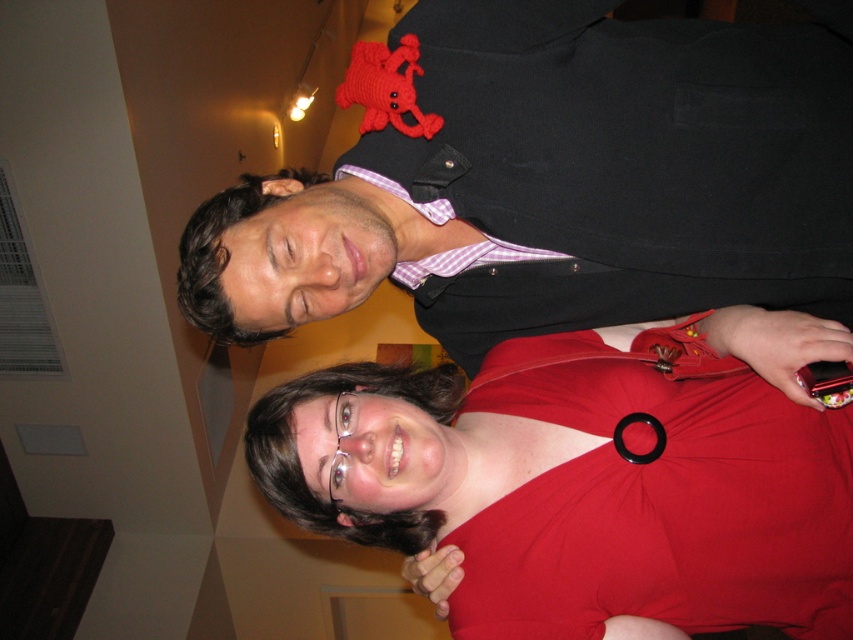
You are taking a photo of two people at an event. You notice two points in the image with coordinates point (358, 76) and point (693, 339). Which point is nearer to the camera?

Point (358, 76) is closer to the camera than point (693, 339).

You are at a party and want to take a photo of both the matte black vest at upper center and the red matte dress at lower center. Which one should you focus on first to ensure both are in focus?

The matte black vest at upper center is closer to the viewer than the red matte dress at lower center. To ensure both are in focus, you should focus on the matte black vest at upper center first since it is closer, and the depth of field may extend to the red matte dress at lower center.

You are a fashion designer observing the matte black vest at upper center and the red matte dress at lower center in the image. Which of these two items has a greater width?

The matte black vest at upper center has a greater width than the red matte dress at lower center according to the description.